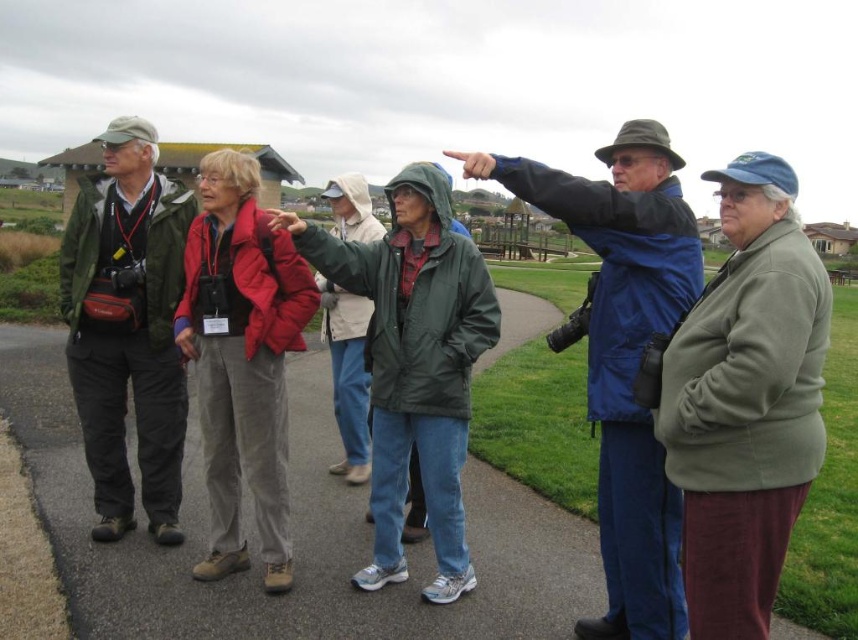
Question: Can you confirm if blue matte jacket at upper center is positioned above red corduroy pants at center?

Choices:
 (A) no
 (B) yes

Answer: (A)

Question: Which point is farther from the camera taking this photo?

Choices:
 (A) (390, 244)
 (B) (376, 600)
 (C) (742, 564)
 (D) (177, 486)

Answer: (D)

Question: Which point appears closest to the camera in this image?

Choices:
 (A) (571, 177)
 (B) (198, 172)
 (C) (375, 432)

Answer: (A)

Question: Is green fleece jacket at right thinner than blue matte jacket at upper center?

Choices:
 (A) no
 (B) yes

Answer: (B)

Question: Does asphalt at center have a greater width compared to blue matte jacket at upper center?

Choices:
 (A) yes
 (B) no

Answer: (A)

Question: Which point is closer to the camera?

Choices:
 (A) (659, 480)
 (B) (778, 294)
 (C) (115, 307)

Answer: (B)